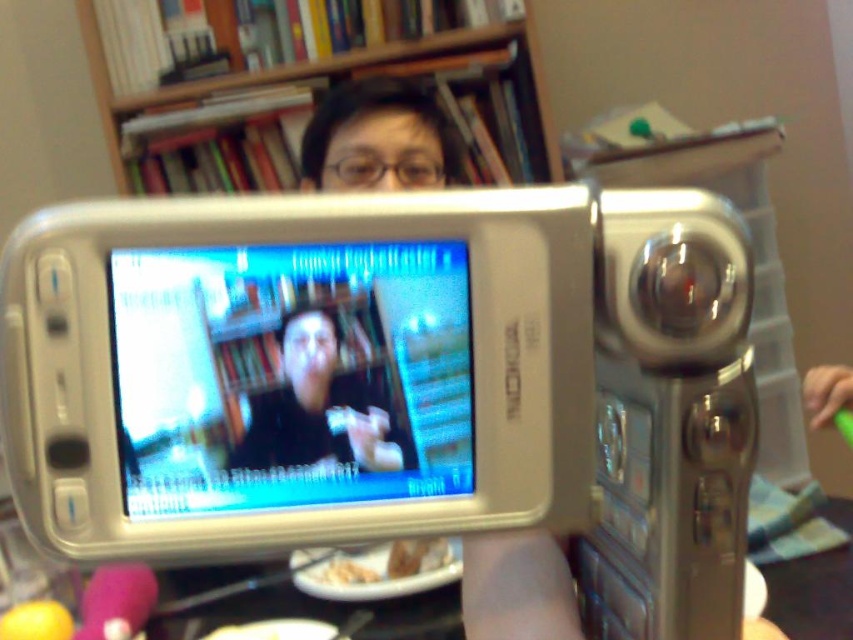
Which is above, silver metallic camera at center or wooden bookshelf at upper center?

wooden bookshelf at upper center

Is silver metallic camera at center in front of wooden bookshelf at upper center?

Yes, silver metallic camera at center is in front of wooden bookshelf at upper center.

Which is in front, point (410, 260) or point (560, 161)?

Point (410, 260) is in front.

This screenshot has height=640, width=853. In order to click on silver metallic camera at center in this screenshot , I will do `click(374, 369)`.

Can you confirm if shiny silver phone at center is positioned to the left of wooden bookshelf at upper center?

Incorrect, shiny silver phone at center is not on the left side of wooden bookshelf at upper center.

Which is below, shiny silver phone at center or wooden bookshelf at upper center?

shiny silver phone at center is below.

Who is more distant from viewer, (279, 326) or (219, 67)?

The point (219, 67) is behind.

Where is `shiny silver phone at center`? shiny silver phone at center is located at coordinates (291, 376).

Between shiny silver phone at center and black matte shirt at center, which one appears on the left side from the viewer's perspective?

From the viewer's perspective, shiny silver phone at center appears more on the left side.

Does shiny silver phone at center lie in front of black matte shirt at center?

Yes.

What do you see at coordinates (291, 376) in the screenshot?
I see `shiny silver phone at center` at bounding box center [291, 376].

Image resolution: width=853 pixels, height=640 pixels. In order to click on shiny silver phone at center in this screenshot , I will do `click(291, 376)`.